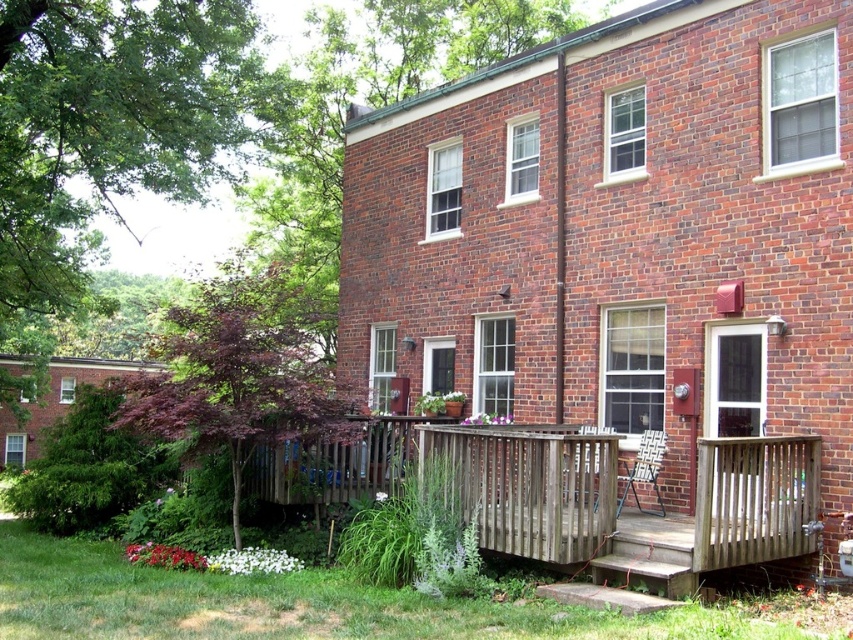
Question: Does weathered wood porch at center appear under weathered wood railing at lower center?

Choices:
 (A) yes
 (B) no

Answer: (A)

Question: Can you confirm if weathered wood porch at center is positioned to the left of weathered wood railing at lower center?

Choices:
 (A) yes
 (B) no

Answer: (B)

Question: Can you confirm if weathered wood porch at center is positioned to the right of weathered wood railing at lower center?

Choices:
 (A) no
 (B) yes

Answer: (B)